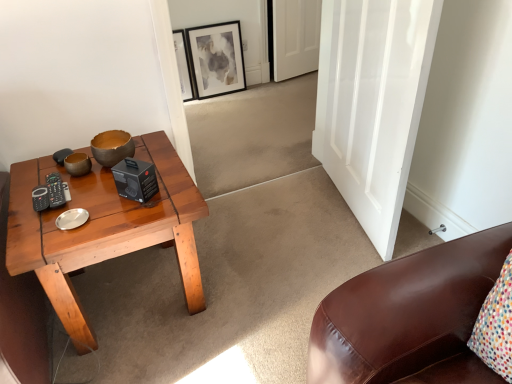
Question: Can you confirm if matte brown bowl at center is bigger than matte black picture frame at upper center?

Choices:
 (A) yes
 (B) no

Answer: (B)

Question: Is matte brown bowl at center shorter than matte black picture frame at upper center?

Choices:
 (A) no
 (B) yes

Answer: (B)

Question: Is matte black picture frame at upper center located within matte brown bowl at center?

Choices:
 (A) yes
 (B) no

Answer: (B)

Question: Does matte brown bowl at center have a greater width compared to matte black picture frame at upper center?

Choices:
 (A) no
 (B) yes

Answer: (B)

Question: Is matte brown bowl at center looking in the opposite direction of matte black picture frame at upper center?

Choices:
 (A) no
 (B) yes

Answer: (A)

Question: Based on their sizes in the image, would you say white matte door at upper center, which is counted as the 2th door, starting from the front, is bigger or smaller than white glossy door at center, which is the 2th door from top to bottom?

Choices:
 (A) big
 (B) small

Answer: (B)

Question: From the image's perspective, relative to white glossy door at center, acting as the first door starting from the front, is white matte door at upper center, the 2th door when ordered from bottom to top, above or below?

Choices:
 (A) above
 (B) below

Answer: (A)

Question: Considering the positions of white matte door at upper center, the 2th door when ordered from bottom to top, and white glossy door at center, marked as the first door in a bottom-to-top arrangement, in the image, is white matte door at upper center, the 2th door when ordered from bottom to top, taller or shorter than white glossy door at center, marked as the first door in a bottom-to-top arrangement,?

Choices:
 (A) tall
 (B) short

Answer: (B)

Question: Visually, is white matte door at upper center, which is the 1th door in top-to-bottom order, positioned to the left or to the right of white glossy door at center, acting as the first door starting from the front?

Choices:
 (A) left
 (B) right

Answer: (A)

Question: Is point (199, 89) closer or farther from the camera than point (330, 29)?

Choices:
 (A) farther
 (B) closer

Answer: (A)

Question: Considering the positions of matte black picture frame at upper center and white glossy door at center, acting as the first door starting from the front, in the image, is matte black picture frame at upper center taller or shorter than white glossy door at center, acting as the first door starting from the front,?

Choices:
 (A) tall
 (B) short

Answer: (B)

Question: Would you say matte black picture frame at upper center is to the left or to the right of white glossy door at center, which is the 2th door from top to bottom, in the picture?

Choices:
 (A) left
 (B) right

Answer: (A)

Question: Which is correct: matte black picture frame at upper center is inside white glossy door at center, marked as the first door in a bottom-to-top arrangement, or outside of it?

Choices:
 (A) inside
 (B) outside

Answer: (B)

Question: Is white matte door at upper center, the 2th door when ordered from bottom to top, situated inside matte black picture frame at upper center or outside?

Choices:
 (A) inside
 (B) outside

Answer: (B)

Question: In terms of width, does white matte door at upper center, the 1th door in the back-to-front sequence, look wider or thinner when compared to matte black picture frame at upper center?

Choices:
 (A) wide
 (B) thin

Answer: (A)